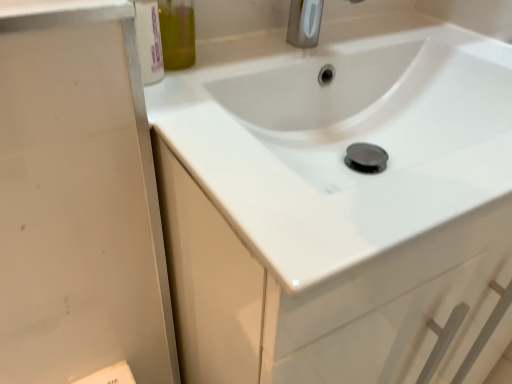
What is the approximate width of olive green glass bottle at upper left?

olive green glass bottle at upper left is 3.05 inches in width.

Find the location of a particular element. The height and width of the screenshot is (384, 512). satin nickel faucet at upper center is located at coordinates (304, 23).

The height and width of the screenshot is (384, 512). Describe the element at coordinates (342, 137) in the screenshot. I see `white glossy sink at center` at that location.

This screenshot has height=384, width=512. I want to click on olive green glass bottle at upper left, so click(177, 33).

Based on the photo, which is closer, (x=230, y=132) or (x=193, y=43)?

Positioned in front is point (x=230, y=132).

Is white glossy sink at center next to olive green glass bottle at upper left?

No, white glossy sink at center is not next to olive green glass bottle at upper left.

Considering the relative sizes of white glossy sink at center and olive green glass bottle at upper left in the image provided, is white glossy sink at center thinner than olive green glass bottle at upper left?

In fact, white glossy sink at center might be wider than olive green glass bottle at upper left.

Is white glossy sink at center taller or shorter than olive green glass bottle at upper left?

Clearly, white glossy sink at center is taller compared to olive green glass bottle at upper left.

From the picture: From the image's perspective, is satin nickel faucet at upper center located beneath olive green glass bottle at upper left?

No, from the image's perspective, satin nickel faucet at upper center is not below olive green glass bottle at upper left.

Between satin nickel faucet at upper center and olive green glass bottle at upper left, which one has larger width?

Wider between the two is satin nickel faucet at upper center.

Is satin nickel faucet at upper center facing away from olive green glass bottle at upper left?

satin nickel faucet at upper center does not have its back to olive green glass bottle at upper left.

Considering the sizes of objects olive green glass bottle at upper left and satin nickel faucet at upper center in the image provided, who is wider, olive green glass bottle at upper left or satin nickel faucet at upper center?

satin nickel faucet at upper center is wider.

This screenshot has width=512, height=384. What are the coordinates of `olive oil above the satin nickel faucet at upper center (from a real-world perspective)` in the screenshot? It's located at (177, 33).

Does olive green glass bottle at upper left lie behind satin nickel faucet at upper center?

No, it is in front of satin nickel faucet at upper center.

Is olive green glass bottle at upper left with white glossy sink at center?

No, olive green glass bottle at upper left is not next to white glossy sink at center.

In terms of height, does olive green glass bottle at upper left look taller or shorter compared to white glossy sink at center?

In the image, olive green glass bottle at upper left appears to be shorter than white glossy sink at center.

Consider the image. Measure the distance from olive green glass bottle at upper left to white glossy sink at center.

They are 27.02 centimeters apart.

In the scene shown: Is satin nickel faucet at upper center inside or outside of white glossy sink at center?

satin nickel faucet at upper center cannot be found inside white glossy sink at center.

Is point (311, 36) less distant than point (347, 265)?

No, it is behind (347, 265).

The height and width of the screenshot is (384, 512). What are the coordinates of `sink in front of the satin nickel faucet at upper center` in the screenshot? It's located at (342, 137).

From a real-world perspective, is white glossy sink at center positioned under satin nickel faucet at upper center based on gravity?

Yes, from a real-world perspective, white glossy sink at center is below satin nickel faucet at upper center.

Considering the relative sizes of white glossy sink at center and satin nickel faucet at upper center in the image provided, is white glossy sink at center smaller than satin nickel faucet at upper center?

Actually, white glossy sink at center might be larger than satin nickel faucet at upper center.

Does point (386, 92) lie in front of point (295, 3)?

No.

From the image's perspective, is white glossy sink at center on satin nickel faucet at upper center?

Actually, white glossy sink at center appears below satin nickel faucet at upper center in the image.

Locate an element on the screen. The width and height of the screenshot is (512, 384). sink in front of the olive green glass bottle at upper left is located at coordinates (342, 137).

Find the location of a particular element. This screenshot has width=512, height=384. olive oil above the satin nickel faucet at upper center (from a real-world perspective) is located at coordinates (177, 33).

Based on their spatial positions, is satin nickel faucet at upper center or olive green glass bottle at upper left closer to white glossy sink at center?

satin nickel faucet at upper center lies closer to white glossy sink at center than the other object.

From the image, which object appears to be nearer to white glossy sink at center, olive green glass bottle at upper left or satin nickel faucet at upper center?

satin nickel faucet at upper center.

Which object lies nearer to the anchor point satin nickel faucet at upper center, white glossy sink at center or olive green glass bottle at upper left?

Based on the image, olive green glass bottle at upper left appears to be nearer to satin nickel faucet at upper center.

Based on their spatial positions, is satin nickel faucet at upper center or white glossy sink at center further from olive green glass bottle at upper left?

Among the two, white glossy sink at center is located further to olive green glass bottle at upper left.

Looking at the image, which one is located closer to olive green glass bottle at upper left, white glossy sink at center or satin nickel faucet at upper center?

satin nickel faucet at upper center is closer to olive green glass bottle at upper left.

Looking at the image, which one is located closer to satin nickel faucet at upper center, olive green glass bottle at upper left or white glossy sink at center?

The object closer to satin nickel faucet at upper center is olive green glass bottle at upper left.

At what (x,y) coordinates should I click in order to perform the action: click on tap between olive green glass bottle at upper left and white glossy sink at center from left to right. Please return your answer as a coordinate pair (x, y). The height and width of the screenshot is (384, 512). Looking at the image, I should click on (304, 23).